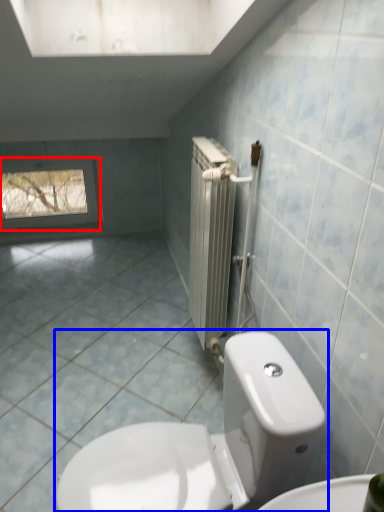
Question: Which point is further to the camera, window (highlighted by a red box) or toilet (highlighted by a blue box)?

Choices:
 (A) window
 (B) toilet

Answer: (A)